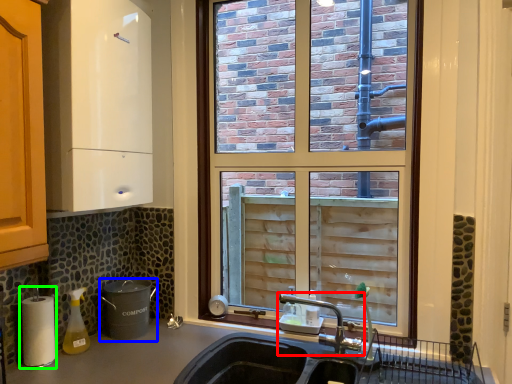
Question: Which object is positioned closest to tap (highlighted by a red box)? Select from appliance (highlighted by a blue box) and appliance (highlighted by a green box).

Choices:
 (A) appliance
 (B) appliance

Answer: (A)